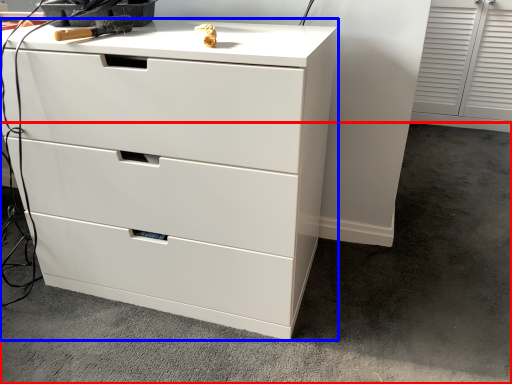
Question: Which object is closer to the camera taking this photo, concrete (highlighted by a red box) or chest of drawers (highlighted by a blue box)?

Choices:
 (A) concrete
 (B) chest of drawers

Answer: (A)